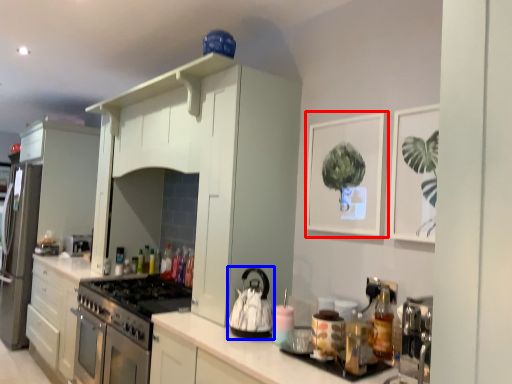
Question: Among these objects, which one is farthest to the camera, picture frame (highlighted by a red box) or kitchen appliance (highlighted by a blue box)?

Choices:
 (A) picture frame
 (B) kitchen appliance

Answer: (A)